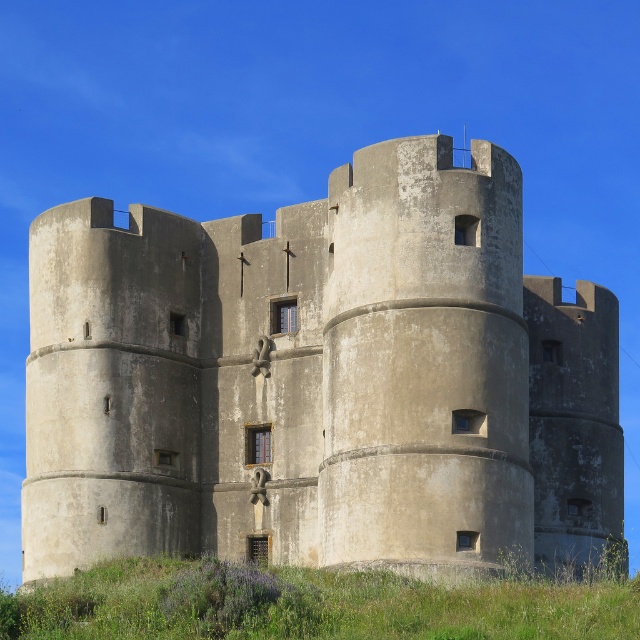
Question: Can you confirm if beige stone castle at center is positioned to the right of green grass at lower center?

Choices:
 (A) no
 (B) yes

Answer: (A)

Question: Can you confirm if beige stone castle at center is thinner than green grass at lower center?

Choices:
 (A) no
 (B) yes

Answer: (A)

Question: Where is beige stone castle at center located in relation to green grass at lower center in the image?

Choices:
 (A) above
 (B) below

Answer: (A)

Question: Among these points, which one is nearest to the camera?

Choices:
 (A) (198, 588)
 (B) (444, 330)

Answer: (A)

Question: Which of the following is the closest to the observer?

Choices:
 (A) (49, 636)
 (B) (362, 232)

Answer: (A)